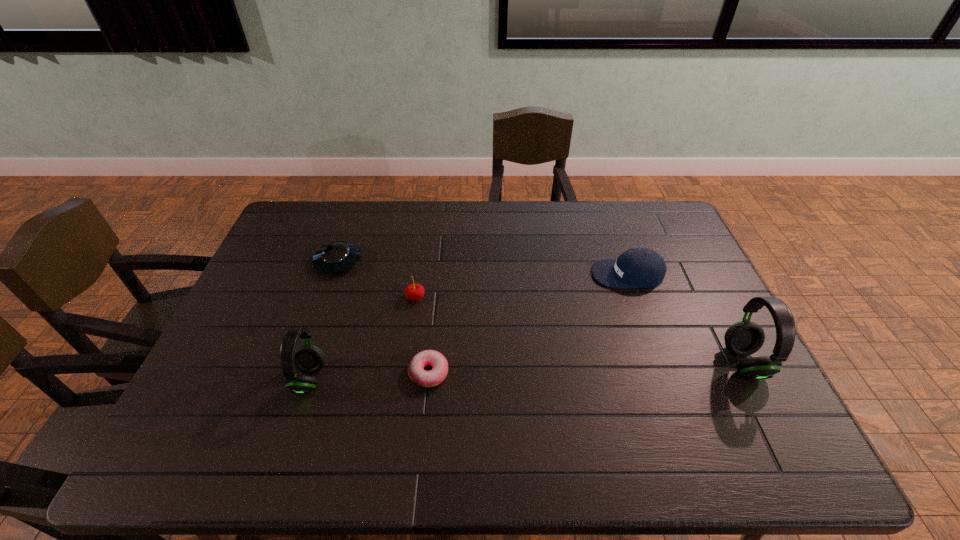
At what (x,y) coordinates should I click in order to perform the action: click on free point located 0.320m on the right of the doughnut. Please return your answer as a coordinate pair (x, y). This screenshot has width=960, height=540. Looking at the image, I should click on (572, 373).

The height and width of the screenshot is (540, 960). Find the location of `doughnut present at the near edge`. doughnut present at the near edge is located at coordinates (433, 377).

The height and width of the screenshot is (540, 960). What are the coordinates of `headset situated at the right edge` in the screenshot? It's located at (743, 338).

This screenshot has height=540, width=960. I want to click on baseball cap located at the right edge, so click(x=638, y=267).

This screenshot has height=540, width=960. What are the coordinates of `object that is at the near right corner` in the screenshot? It's located at (743, 338).

At what (x,y) coordinates should I click in order to perform the action: click on free space at the far edge of the desktop. Please return your answer as a coordinate pair (x, y). Looking at the image, I should click on (343, 201).

At what (x,y) coordinates should I click in order to perform the action: click on free location at the near edge of the desktop. Please return your answer as a coordinate pair (x, y). The image size is (960, 540). Looking at the image, I should click on (314, 418).

In order to click on free region at the left edge of the desktop in this screenshot , I will do `click(248, 380)`.

The height and width of the screenshot is (540, 960). In the image, there is a desktop. Find the location of `free space at the right edge`. free space at the right edge is located at coordinates (650, 245).

The image size is (960, 540). In the image, there is a desktop. What are the coordinates of `vacant space at the far right corner` in the screenshot? It's located at (650, 237).